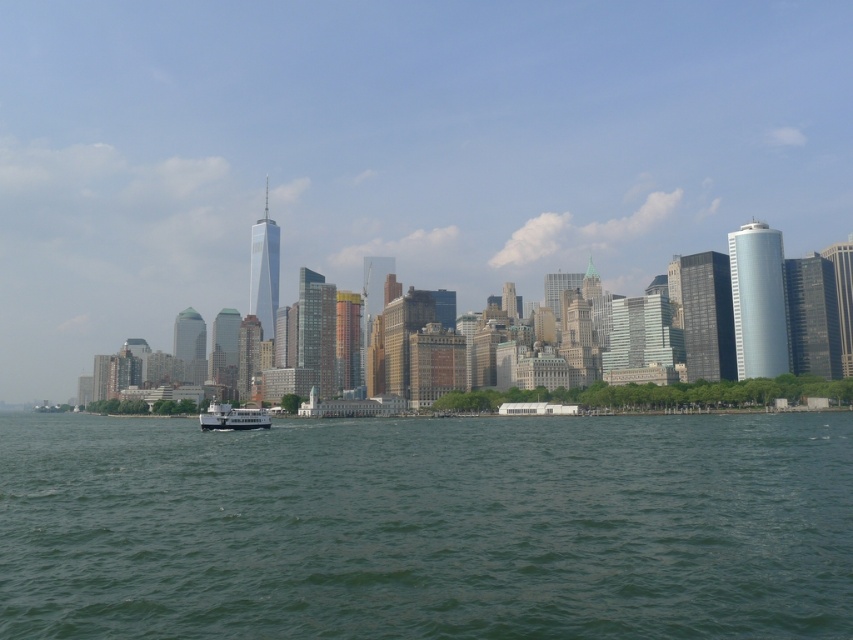
Where is `green water at center`? Image resolution: width=853 pixels, height=640 pixels. green water at center is located at coordinates (427, 528).

Is point (113, 531) closer to viewer compared to point (207, 412)?

Yes, it is.

Locate an element on the screen. The height and width of the screenshot is (640, 853). green water at center is located at coordinates (427, 528).